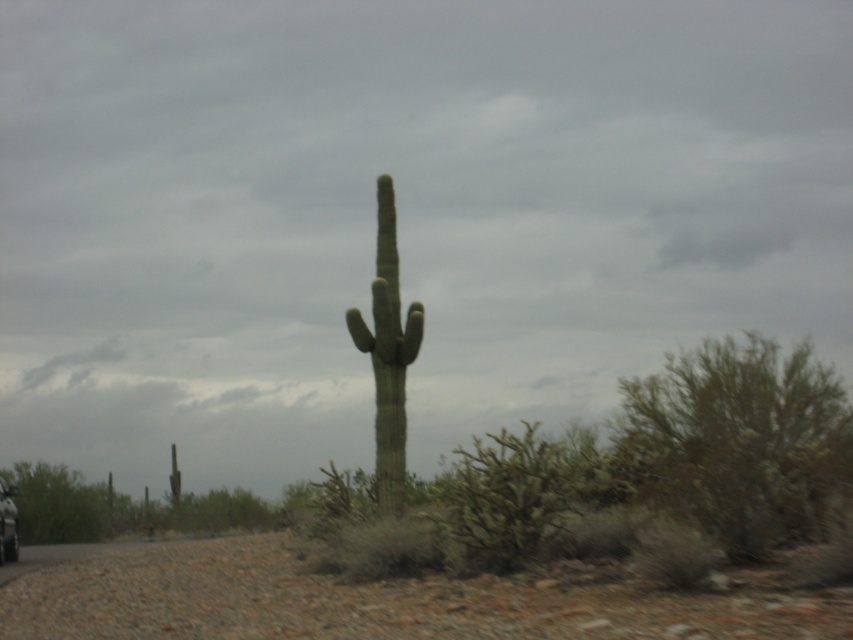
This screenshot has height=640, width=853. Describe the element at coordinates (386, 600) in the screenshot. I see `green spiny cactus at center` at that location.

Between point (795, 593) and point (6, 548), which one is positioned behind?

Point (6, 548)

What do you see at coordinates (386, 600) in the screenshot? This screenshot has width=853, height=640. I see `green spiny cactus at center` at bounding box center [386, 600].

You are a GUI agent. You are given a task and a screenshot of the screen. Output one action in this format:
    pyautogui.click(x=<x>, y=<y>)
    Task: Click on the green spiny cactus at center
    Image resolution: width=853 pixels, height=640 pixels.
    Given the screenshot: What is the action you would take?
    pyautogui.click(x=386, y=600)

Based on the photo, is green fuzzy cactus at center thinner than metallic silver car at lower left?

In fact, green fuzzy cactus at center might be wider than metallic silver car at lower left.

Does point (405, 420) lie behind point (9, 540)?

No.

Which is behind, point (393, 225) or point (4, 500)?

The point (4, 500) is more distant.

This screenshot has height=640, width=853. Find the location of `green fuzzy cactus at center`. green fuzzy cactus at center is located at coordinates (387, 353).

Which is behind, point (740, 573) or point (403, 440)?

The point (403, 440) is behind.

Does green spiny cactus at center have a smaller size compared to green fuzzy cactus at center?

Incorrect, green spiny cactus at center is not smaller in size than green fuzzy cactus at center.

Is point (149, 620) positioned in front of point (399, 300)?

Yes.

The height and width of the screenshot is (640, 853). In order to click on green spiny cactus at center in this screenshot , I will do `click(386, 600)`.